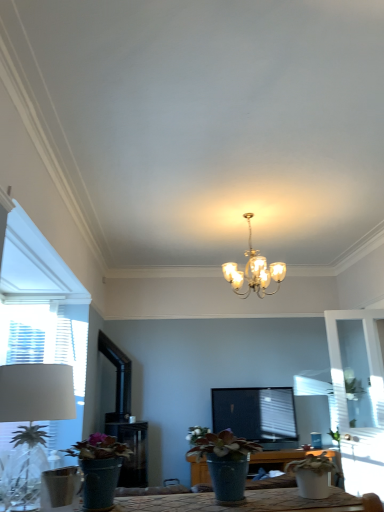
Identify the location of free space above gold metallic chandelier at center (from a real-world perspective). The image size is (384, 512). (258, 211).